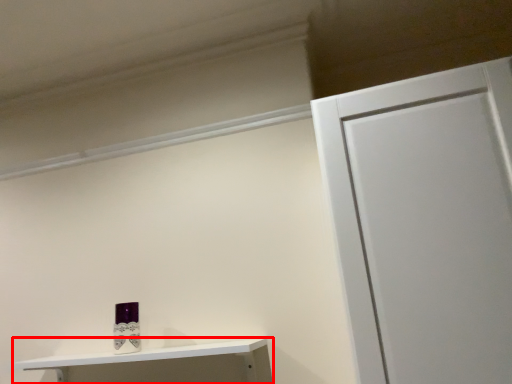
Question: From the image's perspective, what is the correct spatial positioning of shelf (annotated by the red box) in reference to toiletry?

Choices:
 (A) below
 (B) above

Answer: (A)